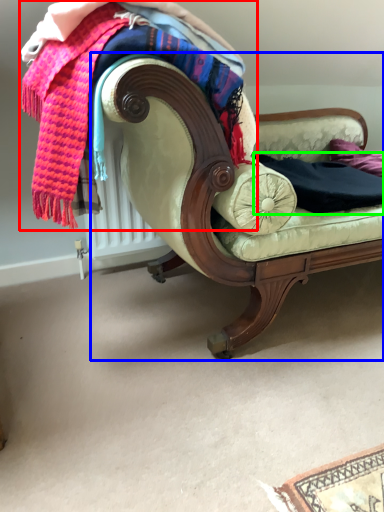
Question: Based on their relative distances, which object is nearer to laundry (highlighted by a red box)? Choose from studio couch (highlighted by a blue box) and clothing (highlighted by a green box).

Choices:
 (A) studio couch
 (B) clothing

Answer: (A)